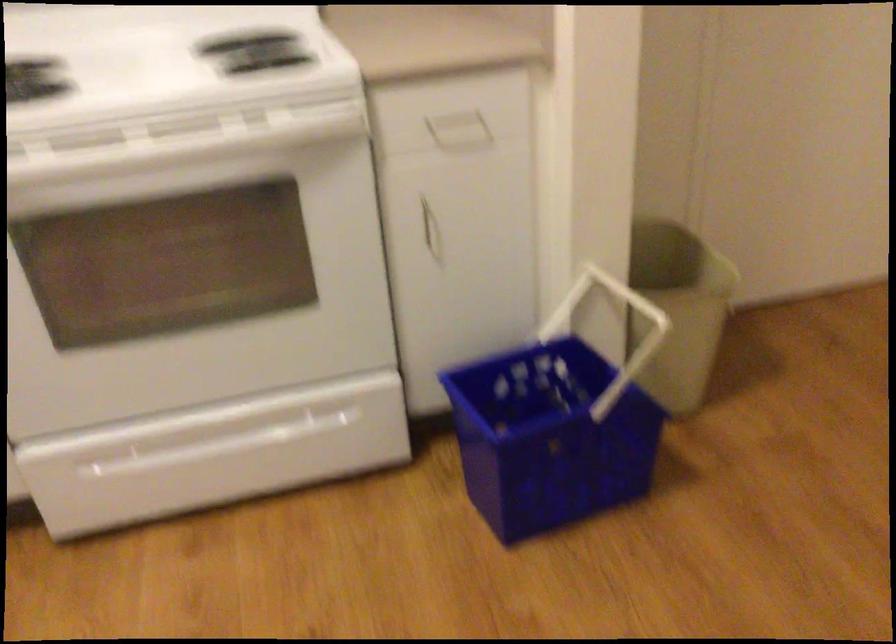
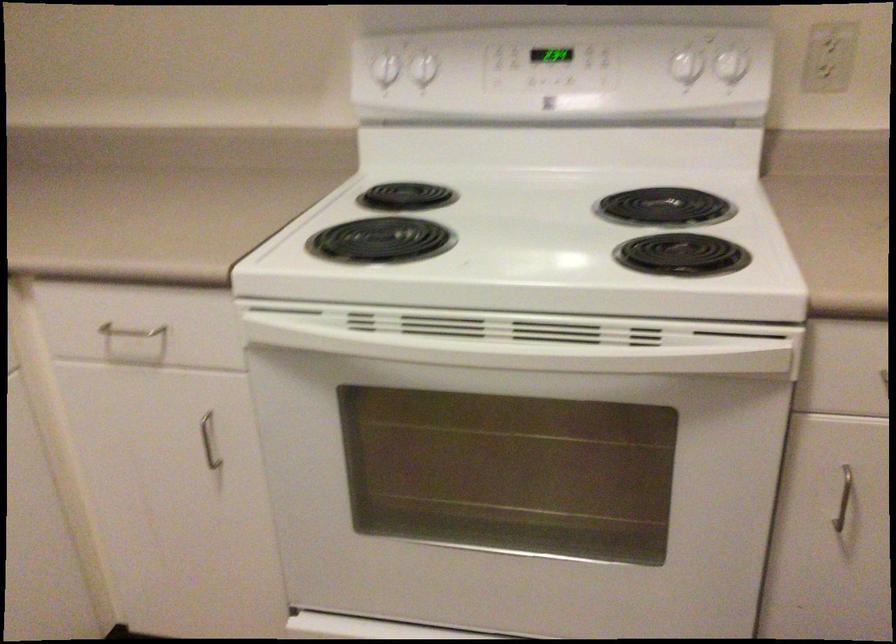
Locate, in the second image, the point that corresponds to (x=167, y=142) in the first image.

(526, 339)